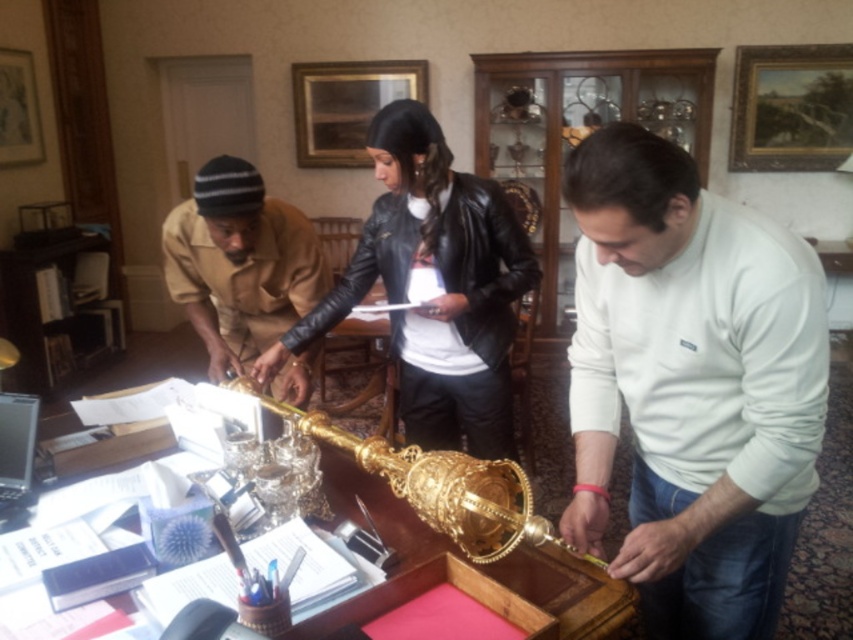
Is white cotton shirt at center closer to camera compared to gold polished table at center?

Yes, it is in front of gold polished table at center.

Based on the photo, who is lower down, white cotton shirt at center or gold polished table at center?

gold polished table at center

Is point (749, 374) closer to camera compared to point (555, 596)?

Yes, it is in front of point (555, 596).

This screenshot has height=640, width=853. Find the location of `white cotton shirt at center`. white cotton shirt at center is located at coordinates (691, 385).

Does black leather jacket at center have a lesser width compared to brown leather jacket at center?

No, black leather jacket at center is not thinner than brown leather jacket at center.

Between point (508, 440) and point (291, 284), which one is positioned behind?

The point (291, 284) is behind.

The image size is (853, 640). In order to click on black leather jacket at center in this screenshot , I will do `click(433, 288)`.

Looking at this image, can you confirm if white cotton shirt at center is positioned below brown leather jacket at center?

Correct, white cotton shirt at center is located below brown leather jacket at center.

Is point (706, 349) more distant than point (236, 164)?

No.

At what (x,y) coordinates should I click in order to perform the action: click on white cotton shirt at center. Please return your answer as a coordinate pair (x, y). Looking at the image, I should click on (691, 385).